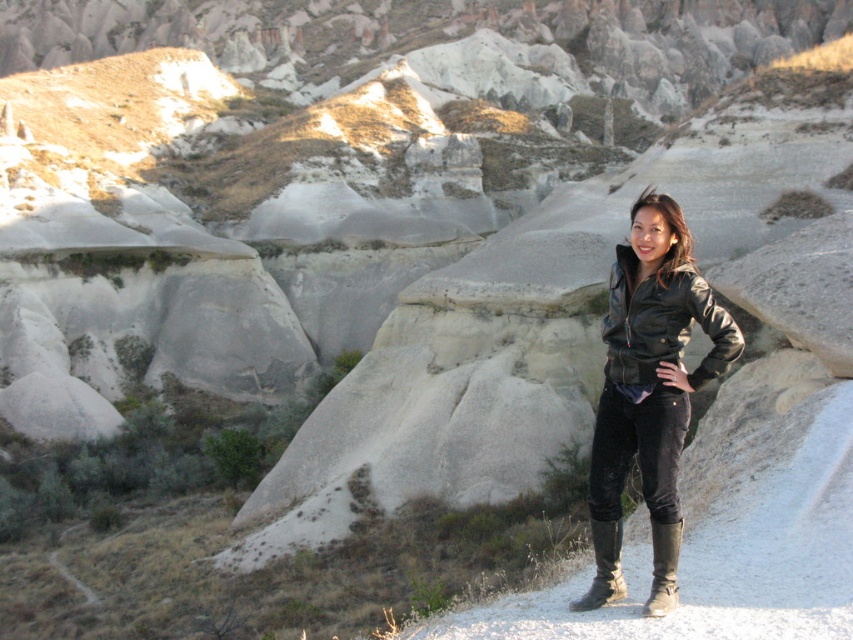
You are a photographer trying to capture the fairy chimneys in Cappadocia. You notice a person wearing a leather jacket at center and a black leather boot at lower right. Which object is higher in the image?

The leather jacket at center is taller than the black leather boot at lower right, so the leather jacket at center is higher in the image.

You are a photographer planning to take a photo of the fairy chimneys in Cappadocia. You notice the black leather jacket at right and the brown suede boot at lower right in your frame. Which object should you adjust your camera to focus on first if you want to capture the one closer to the left side?

The brown suede boot at lower right is closer to the left side, so you should focus on it first.

Based on the photo, you are a photographer planning to capture the fairy chimney formations in Cappadocia. You notice a person in dark clothing at the scene. Which object, the leather jacket at center or the black leather boot at lower right, would you focus on to ensure it fits entirely within your camera frame if the frame can only accommodate the wider of the two?

The leather jacket at center is wider than the black leather boot at lower right. Therefore, focusing on the leather jacket at center ensures it fits entirely within the camera frame since it is the wider object.